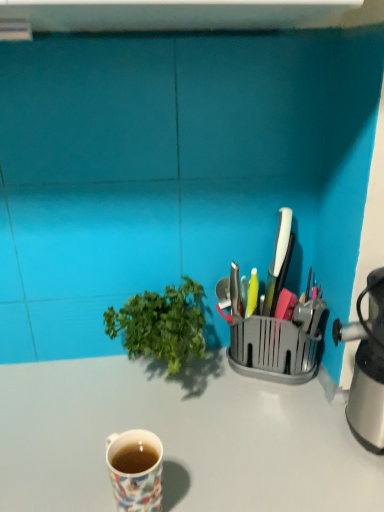
Image resolution: width=384 pixels, height=512 pixels. In order to click on space that is in front of metallic silver knife block at right in this screenshot , I will do `click(268, 417)`.